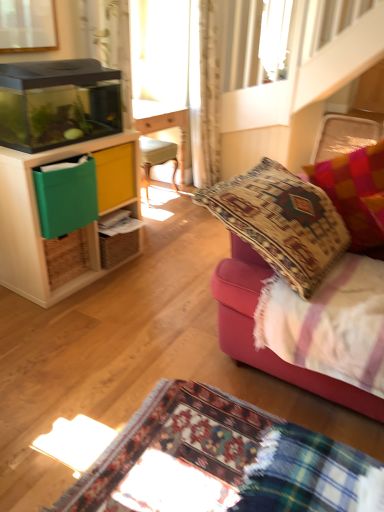
Question: Is velvet cushion at right taller or shorter than multicolored woven pillow at right?

Choices:
 (A) short
 (B) tall

Answer: (B)

Question: Considering their positions, is velvet cushion at right located in front of or behind multicolored woven pillow at right?

Choices:
 (A) front
 (B) behind

Answer: (A)

Question: Which object is positioned closest to the matte wood cabinet at left?

Choices:
 (A) multicolored woven pillow at right
 (B) velvet cushion at right
 (C) light beige textured curtain at upper center

Answer: (B)

Question: Estimate the real-world distances between objects in this image. Which object is farther from the multicolored woven pillow at right?

Choices:
 (A) light beige textured curtain at upper center
 (B) matte wood cabinet at left
 (C) velvet cushion at right

Answer: (A)